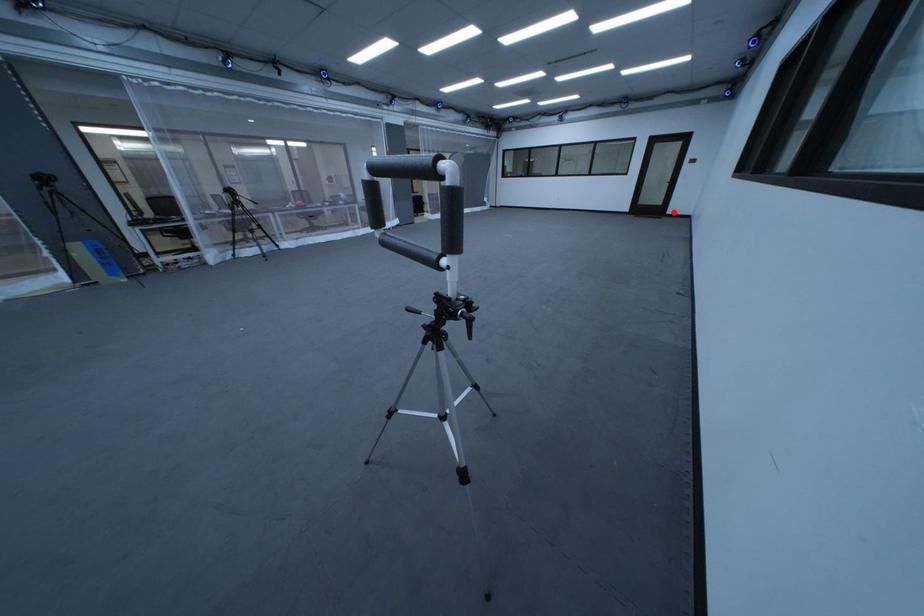
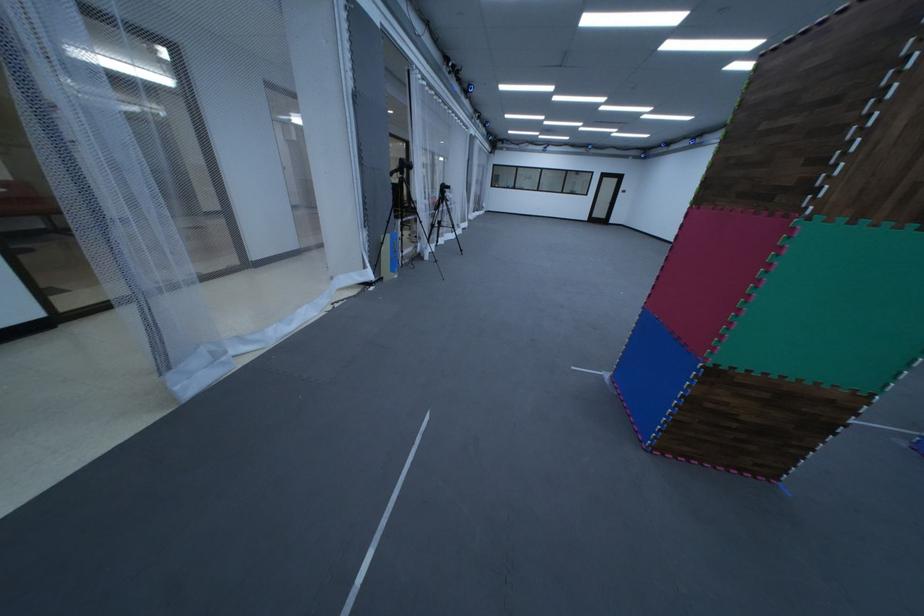
In the second image, find the point that corresponds to the highlighted location in the first image.

(621, 223)